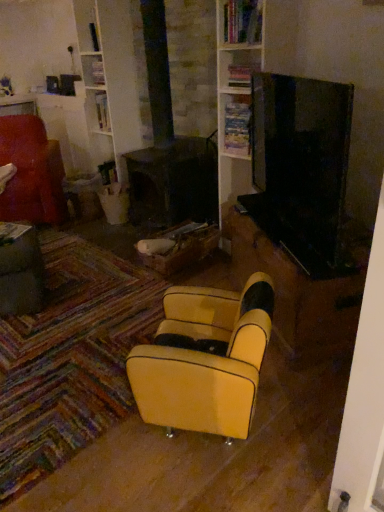
You are a GUI agent. You are given a task and a screenshot of the screen. Output one action in this format:
    pyautogui.click(x=<x>, y=<y>)
    Task: Click on the unoccupied region to the right of metallic gray table at lower left
    The height and width of the screenshot is (512, 384).
    Given the screenshot: What is the action you would take?
    pyautogui.click(x=88, y=291)